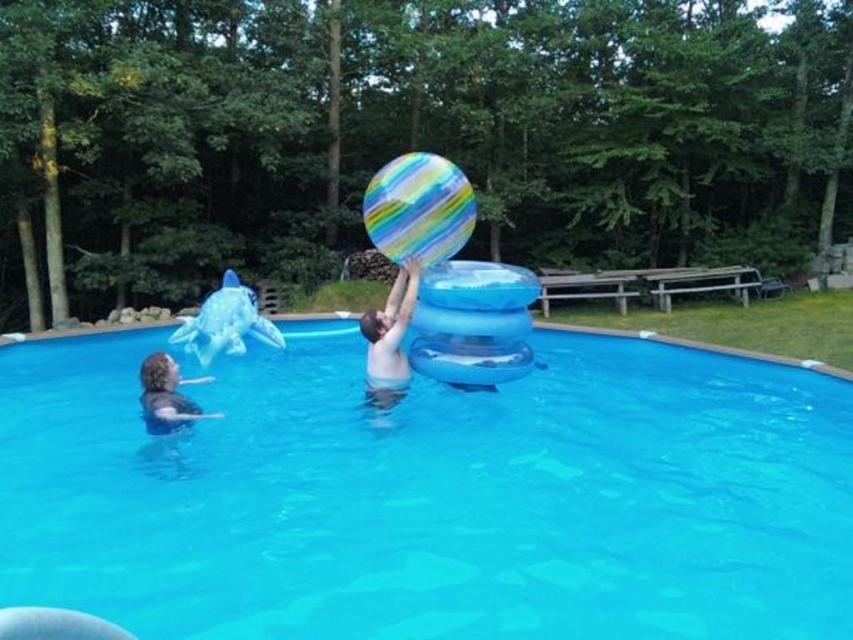
You are standing on the wooden deck near the edge of the transparent blue pool at center and want to grab the multicolored striped beach ball at center. Which direction should you move to reach the ball?

The transparent blue pool at center is to the right of the multicolored striped beach ball at center, so you should move to your left to reach the ball.

Consider the image. You are standing at the edge of the pool and want to reach the multicolored striped beach ball at center. Based on the coordinates provided, in which direction should you move to get closer to the ball?

The multicolored striped beach ball at center is located at coordinates point (418, 209). Since you are at the edge, you should move towards the center of the pool to reach it.